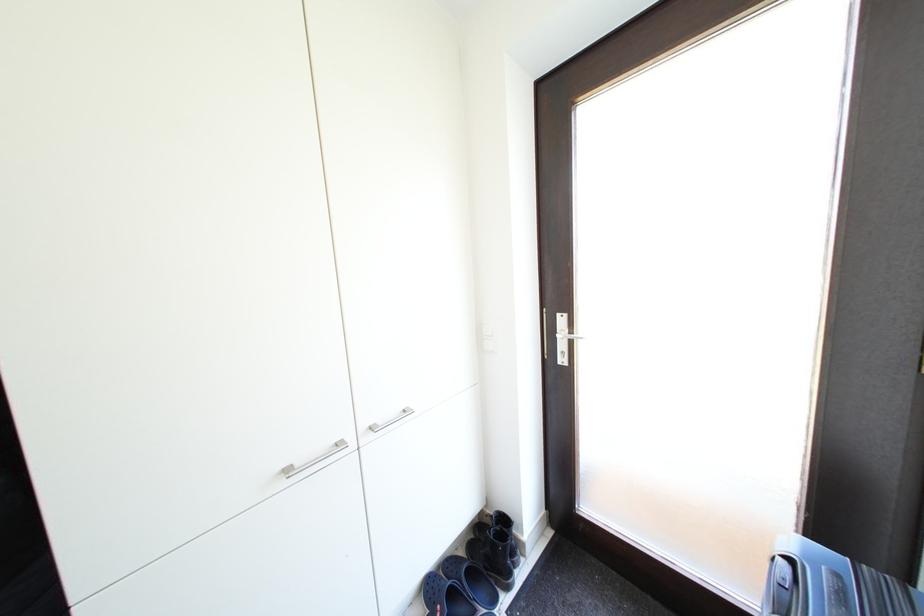
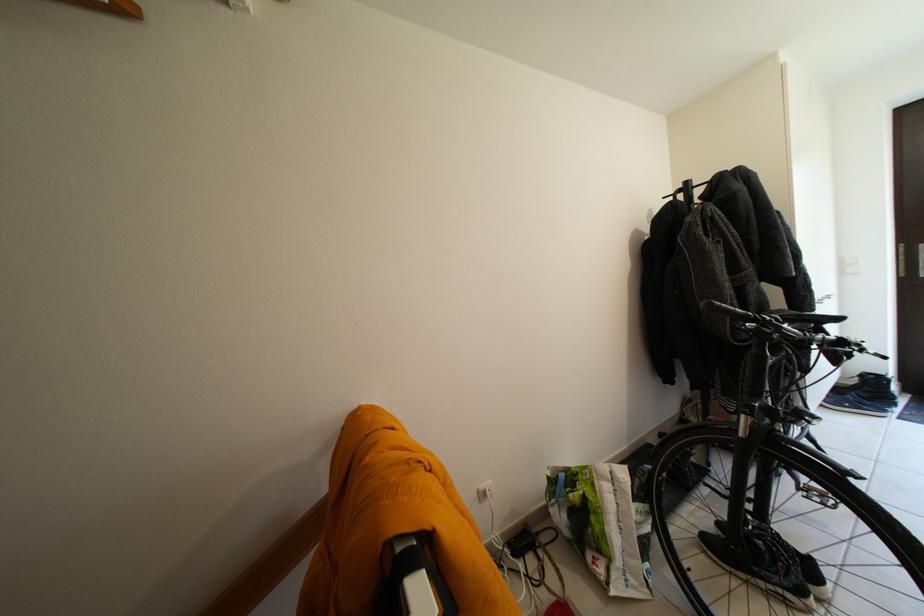
In a continuous first-person perspective shot, in which direction is the camera moving?

The cameraman walked toward left, backward.